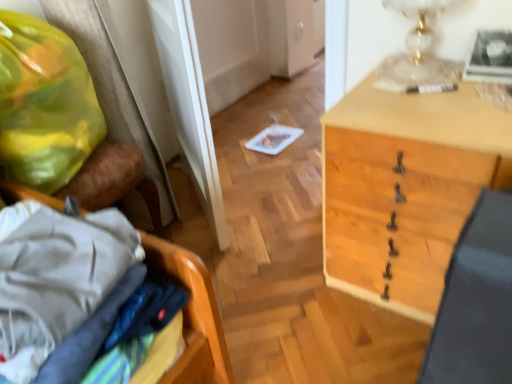
Image resolution: width=512 pixels, height=384 pixels. In order to click on white glass table lamp at upper right in this screenshot , I will do `click(416, 50)`.

This screenshot has width=512, height=384. Identify the location of wooden laundry basket at left. (193, 316).

What is the approximate height of wooden desk at center?

24.47 inches.

Describe the element at coordinates (109, 91) in the screenshot. I see `yellow plastic bag at left` at that location.

At what (x,y) coordinates should I click in order to perform the action: click on yellow plastic bag at left. Please return your answer as a coordinate pair (x, y). Looking at the image, I should click on (109, 91).

I want to click on black leather swivel chair at lower right, so click(476, 301).

From the image's perspective, which is above, white glass table lamp at upper right or yellow plastic bag at left?

white glass table lamp at upper right, from the image's perspective.

From a real-world perspective, between white glass table lamp at upper right and yellow plastic bag at left, who is vertically lower?

yellow plastic bag at left, from a real-world perspective.

Based on the photo, in terms of width, does white glass table lamp at upper right look wider or thinner when compared to yellow plastic bag at left?

Considering their sizes, white glass table lamp at upper right looks slimmer than yellow plastic bag at left.

Which object is more forward, yellow plastic bag at left or wooden desk at center?

wooden desk at center is in front.

In the scene shown: Is yellow plastic bag at left to the left or to the right of wooden desk at center in the image?

yellow plastic bag at left is to the left of wooden desk at center.

Find the location of a particular element. desk below the yellow plastic bag at left (from a real-world perspective) is located at coordinates (405, 189).

From the image's perspective, which is above, wooden desk at center or white glass table lamp at upper right?

white glass table lamp at upper right, from the image's perspective.

Is wooden desk at center next to white glass table lamp at upper right and touching it?

There is a gap between wooden desk at center and white glass table lamp at upper right.

Looking at their sizes, would you say wooden desk at center is wider or thinner than white glass table lamp at upper right?

Considering their sizes, wooden desk at center looks broader than white glass table lamp at upper right.

Is white glass table lamp at upper right at the left side of wooden laundry basket at left?

No, white glass table lamp at upper right is not to the left of wooden laundry basket at left.

Is point (403, 60) positioned after point (177, 368)?

Yes, it is.

Can you confirm if white glass table lamp at upper right is shorter than wooden laundry basket at left?

Correct, white glass table lamp at upper right is not as tall as wooden laundry basket at left.

Which of these two, white glass table lamp at upper right or wooden desk at center, stands taller?

Standing taller between the two is wooden desk at center.

Looking at the image, does white glass table lamp at upper right seem bigger or smaller compared to wooden desk at center?

In the image, white glass table lamp at upper right appears to be smaller than wooden desk at center.

Does white glass table lamp at upper right turn towards wooden desk at center?

No, white glass table lamp at upper right is not aimed at wooden desk at center.

From the picture: Could wooden desk at center be considered to be inside white glass table lamp at upper right?

No.

Does yellow plastic bag at left come behind black leather swivel chair at lower right?

Yes, it is behind black leather swivel chair at lower right.

Does yellow plastic bag at left turn towards black leather swivel chair at lower right?

Yes, yellow plastic bag at left is aimed at black leather swivel chair at lower right.

Is black leather swivel chair at lower right completely or partially inside yellow plastic bag at left?

No.

Does yellow plastic bag at left have a lesser width compared to black leather swivel chair at lower right?

No.

From a real-world perspective, is black leather swivel chair at lower right located higher than yellow plastic bag at left?

Actually, black leather swivel chair at lower right is physically below yellow plastic bag at left in the real world.

Looking at this image, is black leather swivel chair at lower right to the right of yellow plastic bag at left from the viewer's perspective?

Correct, you'll find black leather swivel chair at lower right to the right of yellow plastic bag at left.

Is black leather swivel chair at lower right thinner than yellow plastic bag at left?

Indeed, black leather swivel chair at lower right has a lesser width compared to yellow plastic bag at left.

Locate an element on the screen. swivel chair below the yellow plastic bag at left (from a real-world perspective) is located at coordinates (476, 301).

Find the location of `rocking chair on the left of white glass table lamp at upper right`. rocking chair on the left of white glass table lamp at upper right is located at coordinates (109, 91).

Locate an element on the screen. rocking chair that appears above the wooden desk at center (from a real-world perspective) is located at coordinates (109, 91).

From the image, which object appears to be nearer to yellow plastic bag at left, white glass table lamp at upper right or wooden laundry basket at left?

The object closer to yellow plastic bag at left is wooden laundry basket at left.

Looking at the image, which one is located closer to wooden laundry basket at left, black leather swivel chair at lower right or white glass table lamp at upper right?

black leather swivel chair at lower right is closer to wooden laundry basket at left.

Considering their positions, is wooden laundry basket at left positioned further to yellow plastic bag at left than wooden desk at center?

wooden desk at center lies further to yellow plastic bag at left than the other object.

Considering their positions, is white glass table lamp at upper right positioned closer to black leather swivel chair at lower right than wooden laundry basket at left?

The object closer to black leather swivel chair at lower right is wooden laundry basket at left.

Considering their positions, is yellow plastic bag at left positioned closer to wooden desk at center than black leather swivel chair at lower right?

black leather swivel chair at lower right.

Estimate the real-world distances between objects in this image. Which object is further from wooden desk at center, yellow plastic bag at left or wooden laundry basket at left?

yellow plastic bag at left is further to wooden desk at center.

Looking at the image, which one is located closer to black leather swivel chair at lower right, wooden laundry basket at left or yellow plastic bag at left?

wooden laundry basket at left is closer to black leather swivel chair at lower right.

From the image, which object appears to be farther from white glass table lamp at upper right, wooden desk at center or black leather swivel chair at lower right?

black leather swivel chair at lower right is further to white glass table lamp at upper right.

In order to click on swivel chair situated between wooden laundry basket at left and wooden desk at center from left to right in this screenshot , I will do `click(476, 301)`.

Image resolution: width=512 pixels, height=384 pixels. Find the location of `swivel chair between yellow plastic bag at left and wooden desk at center from left to right`. swivel chair between yellow plastic bag at left and wooden desk at center from left to right is located at coordinates (476, 301).

Find the location of a particular element. furniture between yellow plastic bag at left and white glass table lamp at upper right from left to right is located at coordinates (193, 316).

The image size is (512, 384). I want to click on table lamp between wooden laundry basket at left and wooden desk at center in the horizontal direction, so click(x=416, y=50).